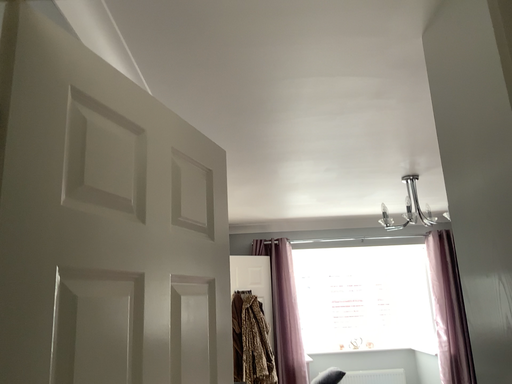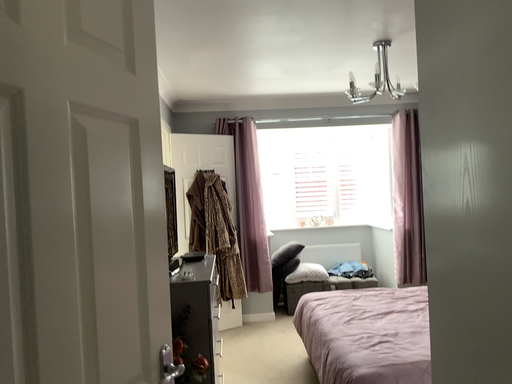
Question: Which way did the camera rotate in the video?

Choices:
 (A) rotated downward
 (B) rotated upward

Answer: (A)